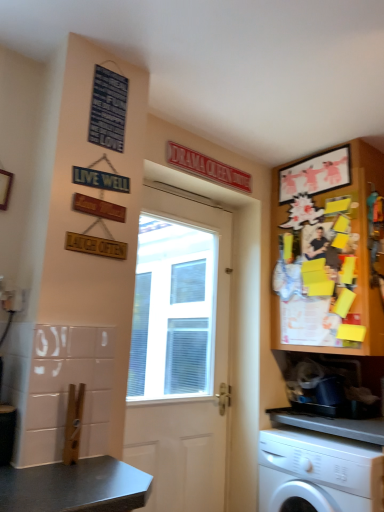
Question: From a real-world perspective, is wooden bulletin board at upper right physically above white plastic washing machine at lower right?

Choices:
 (A) yes
 (B) no

Answer: (A)

Question: Does wooden bulletin board at upper right come behind white plastic washing machine at lower right?

Choices:
 (A) no
 (B) yes

Answer: (B)

Question: Is wooden bulletin board at upper right closer to camera compared to white plastic washing machine at lower right?

Choices:
 (A) no
 (B) yes

Answer: (A)

Question: Is wooden bulletin board at upper right bigger than white plastic washing machine at lower right?

Choices:
 (A) yes
 (B) no

Answer: (A)

Question: From the image's perspective, is wooden bulletin board at upper right above white plastic washing machine at lower right?

Choices:
 (A) no
 (B) yes

Answer: (B)

Question: Is wooden bulletin board at upper right wider than white plastic washing machine at lower right?

Choices:
 (A) no
 (B) yes

Answer: (B)

Question: From a real-world perspective, is white plastic washing machine at lower right physically above wooden bulletin board at upper right?

Choices:
 (A) no
 (B) yes

Answer: (A)

Question: Does white plastic washing machine at lower right have a larger size compared to wooden bulletin board at upper right?

Choices:
 (A) no
 (B) yes

Answer: (A)

Question: Is white plastic washing machine at lower right thinner than wooden bulletin board at upper right?

Choices:
 (A) no
 (B) yes

Answer: (B)

Question: Is white plastic washing machine at lower right further to camera compared to wooden bulletin board at upper right?

Choices:
 (A) yes
 (B) no

Answer: (B)

Question: Considering the relative positions of white plastic washing machine at lower right and wooden bulletin board at upper right in the image provided, is white plastic washing machine at lower right to the left of wooden bulletin board at upper right from the viewer's perspective?

Choices:
 (A) no
 (B) yes

Answer: (B)

Question: Is white plastic washing machine at lower right facing towards wooden bulletin board at upper right?

Choices:
 (A) no
 (B) yes

Answer: (A)

Question: From the image's perspective, would you say white plastic washing machine at lower right is shown under white wooden door at center?

Choices:
 (A) no
 (B) yes

Answer: (B)